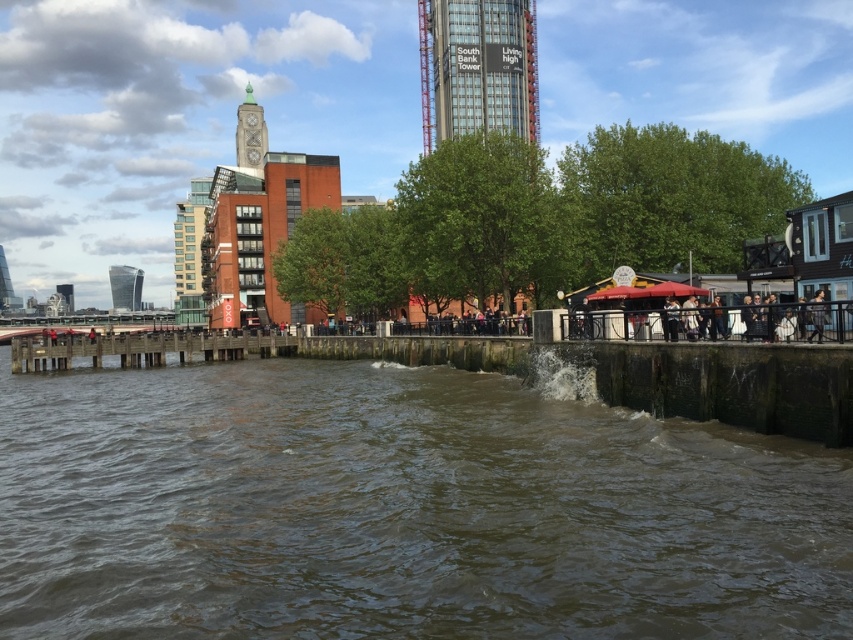
Looking at this image, who is more distant from viewer, (486, 17) or (119, 282)?

Point (119, 282)

Can you confirm if glassy glass tower at upper center is thinner than silver glass tower at left?

Indeed, glassy glass tower at upper center has a lesser width compared to silver glass tower at left.

Who is more forward, (437, 83) or (125, 285)?

Point (437, 83) is more forward.

This screenshot has height=640, width=853. I want to click on glassy glass tower at upper center, so click(477, 68).

Does brown water at lower center appear on the right side of matte gray clock tower at upper center?

Indeed, brown water at lower center is positioned on the right side of matte gray clock tower at upper center.

Does brown water at lower center appear under matte gray clock tower at upper center?

Indeed, brown water at lower center is positioned under matte gray clock tower at upper center.

Between point (575, 508) and point (247, 154), which one is positioned in front?

Positioned in front is point (575, 508).

Locate an element on the screen. The height and width of the screenshot is (640, 853). brown water at lower center is located at coordinates (402, 508).

What do you see at coordinates (250, 132) in the screenshot? The width and height of the screenshot is (853, 640). I see `matte gray clock tower at upper center` at bounding box center [250, 132].

Can you confirm if matte gray clock tower at upper center is positioned to the right of matte glass tower at left?

Yes, matte gray clock tower at upper center is to the right of matte glass tower at left.

Does point (247, 88) come in front of point (59, 284)?

Yes.

Find the location of a particular element. The image size is (853, 640). matte gray clock tower at upper center is located at coordinates (250, 132).